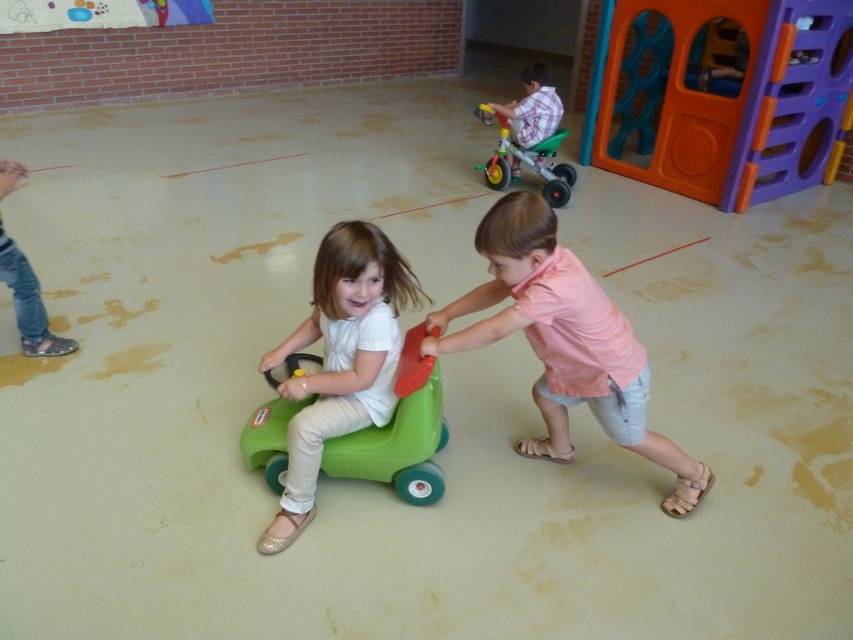
You are a photographer setting up for a photo shoot in this play area. You want to ensure the pink cotton shirt at center and the green plastic tricycle at upper right are both visible in the shot. Based on their positions, which object should appear closer to the camera?

The pink cotton shirt at center is in front of the green plastic tricycle at upper right, so the pink cotton shirt at center will appear closer to the camera.

You are a parent trying to ensure your child can safely move from the green matte toy car at center to the green plastic tricycle at upper right. Considering the space between them, can your child walk directly between these two toys without needing to navigate around any obstacles?

The distance between the green matte toy car at center and the green plastic tricycle at upper right is 3.05 meters, which provides ample space for a child to walk directly between them without needing to navigate around obstacles.